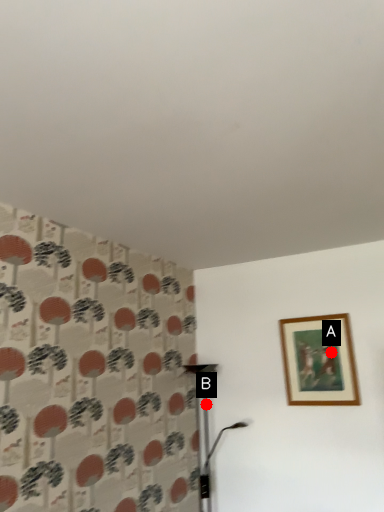
Question: Two points are circled on the image, labeled by A and B beside each circle. Which point appears closest to the camera in this image?

Choices:
 (A) A is closer
 (B) B is closer

Answer: (A)